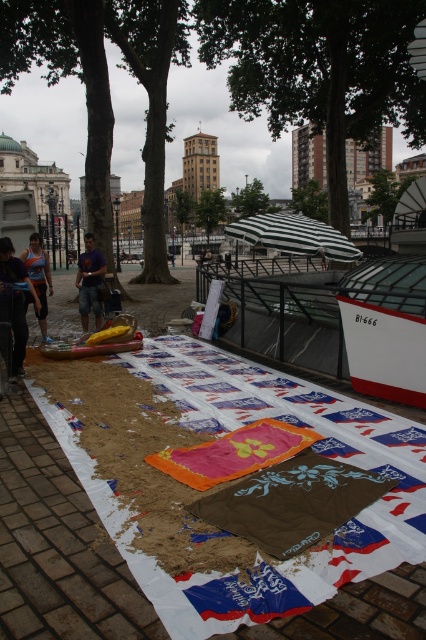
You are standing in the plaza looking at the setup on the brick pavement. There are two points marked on the image, one at coordinates point (31, 296) and another at point (114, 348). Which point is closer to you?

Point (31, 296) is closer to the camera than point (114, 348).

You are standing at the center of the brick square and want to place a small gift box on the brown paper at center. Where exactly should you place it?

The brown paper at center is located at coordinates point (57, 545), so you should place the small gift box at that exact point.